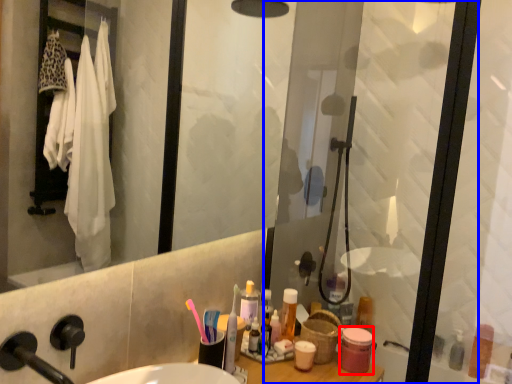
Question: Which of the following is the closest to the observer, toiletry (highlighted by a red box) or screen door (highlighted by a blue box)?

Choices:
 (A) toiletry
 (B) screen door

Answer: (B)